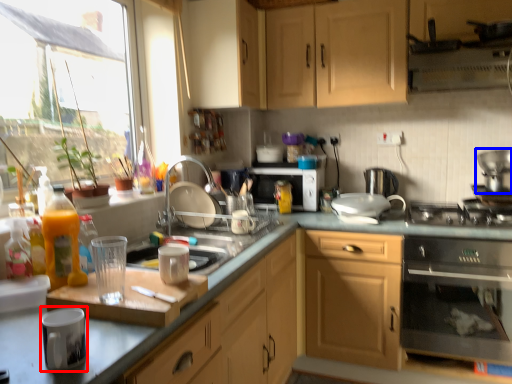
Question: Which point is further to the camera, appliance (highlighted by a red box) or appliance (highlighted by a blue box)?

Choices:
 (A) appliance
 (B) appliance

Answer: (B)